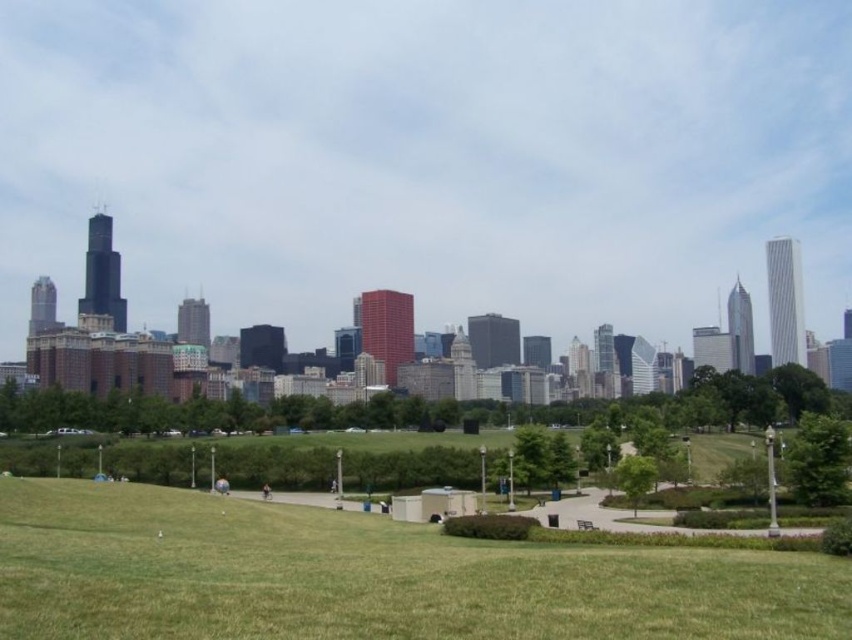
From the picture: You are a photographer standing at the lower center of the park. You want to take a photo that includes both the matte glass skyscrapers at upper center and the brown leather jacket at lower center. Which object will appear larger in the photo?

The matte glass skyscrapers at upper center will appear larger in the photo because they are bigger than the brown leather jacket at lower center.

You are a city planner assessing the park layout. You notice the matte glass skyscrapers at upper center and the dark blue jeans at center. Which object is taller? Please base your answer on the spatial relationships described in the scene.

The matte glass skyscrapers at upper center are taller than the dark blue jeans at center.

You are a photographer standing at the edge of the green grassy field at center and the brown leather jacket at lower center. You want to take a photo that includes both objects in the frame. Which object should be placed closer to the camera to ensure both are fully visible?

The green grassy field at center is much taller than the brown leather jacket at lower center, so to ensure both are fully visible in the photo, the brown leather jacket at lower center should be placed closer to the camera. This way, the shorter jacket will be in focus, and the taller grassy field can be captured in the background without being cut off.